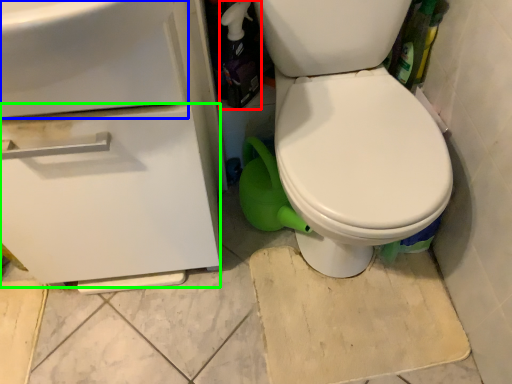
Question: Based on their relative distances, which object is nearer to bottle (highlighted by a red box)? Choose from sink (highlighted by a blue box) and drawer (highlighted by a green box).

Choices:
 (A) sink
 (B) drawer

Answer: (B)